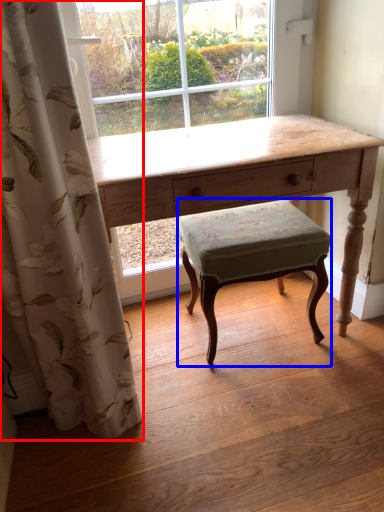
Question: Which of the following is the farthest to the observer, curtain (highlighted by a red box) or stool (highlighted by a blue box)?

Choices:
 (A) curtain
 (B) stool

Answer: (B)